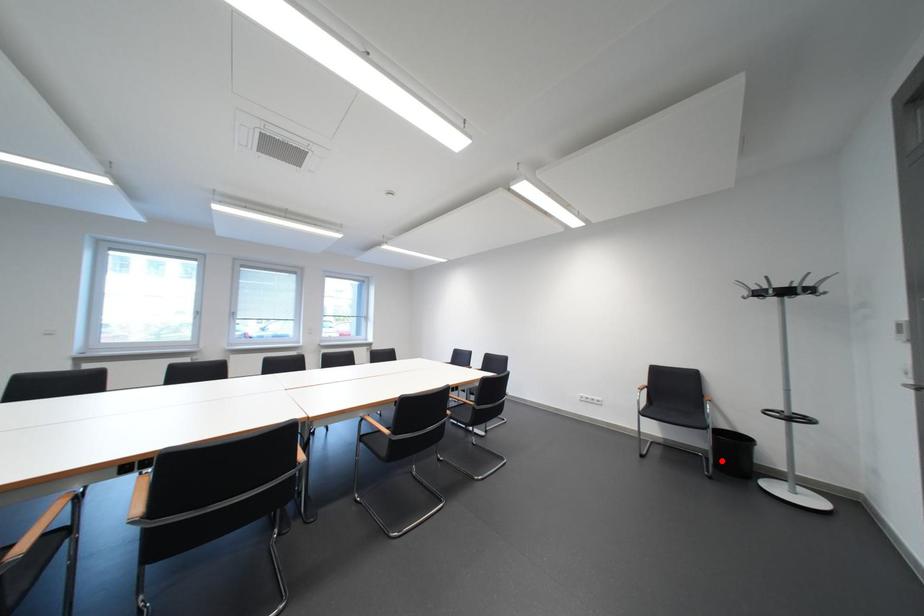
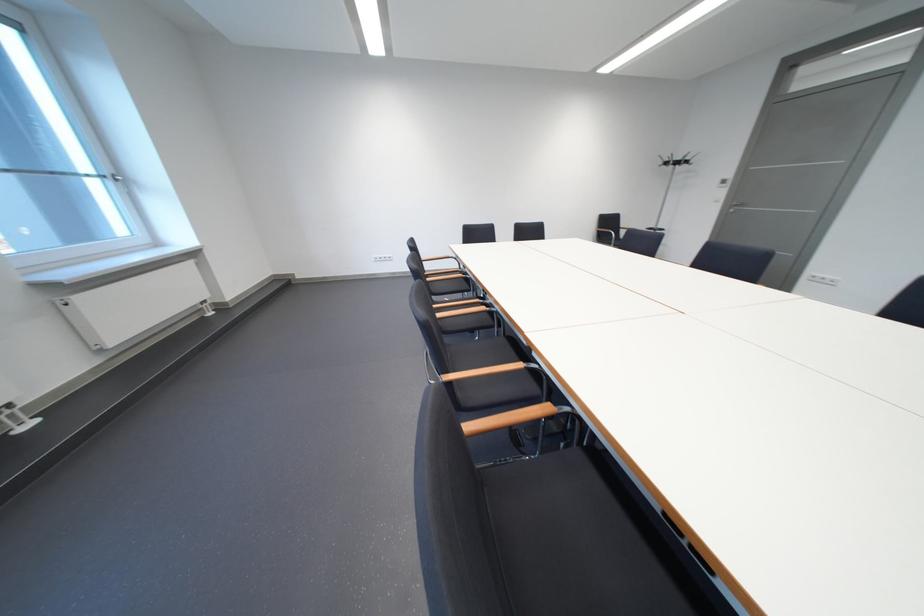
Question: I am providing you with two images of the same scene from different viewpoints. A red point is marked on the first image. Is the red point's position out of view in image 2?

Choices:
 (A) Yes
 (B) No

Answer: (A)